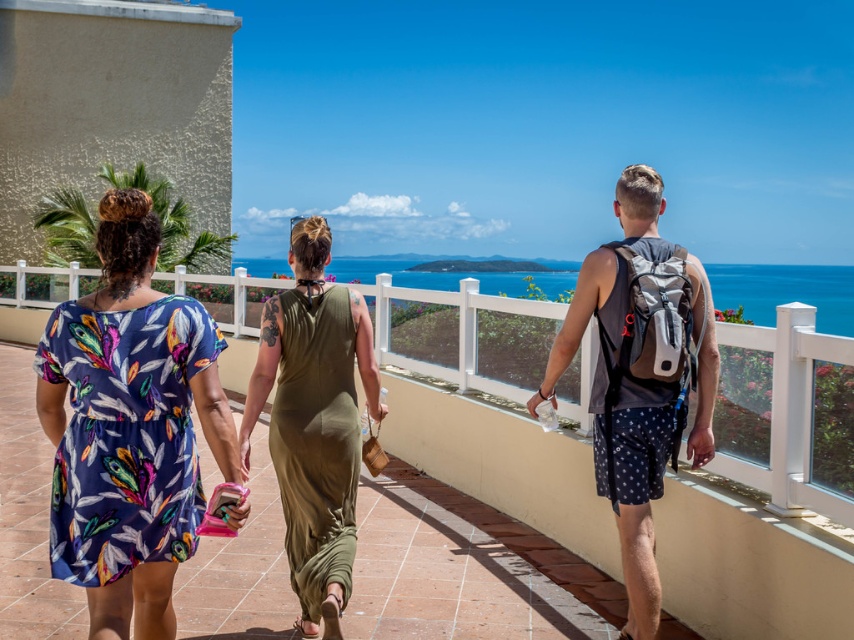
Looking at this image, you are a photographer standing on the pathway. You want to take a photo of the blue water at center without the gray fabric backpack at center blocking the view. Should you move forward or backward?

The gray fabric backpack at center is in front of the blue water at center. To avoid the backpack blocking the view, you should move backward so the backpack moves out of the frame or becomes smaller in the background.

You are a photographer trying to capture the scenic coastal view. You notice the printed fabric dress at left and the blue water at center. Which object should you focus on to ensure it takes up more space in your photo?

The blue water at center is larger than the printed fabric dress at left, so focusing on the blue water at center will ensure it takes up more space in your photo.

You are standing on the pathway and want to take a photo of the printed fabric dress at left and the olive green satin dress at center. Which dress should you focus on first to ensure both are in clear focus?

You should focus on the printed fabric dress at left first because it is closer to you than the olive green satin dress at center, so adjusting focus from near to far will help both be in clear focus.